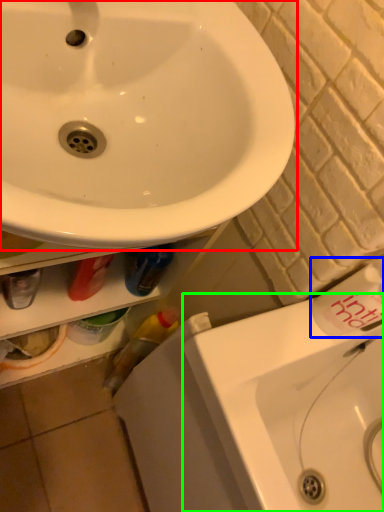
Question: Estimate the real-world distances between objects in this image. Which object is closer to sink (highlighted by a red box), toiletry (highlighted by a blue box) or counter top (highlighted by a green box)?

Choices:
 (A) toiletry
 (B) counter top

Answer: (A)